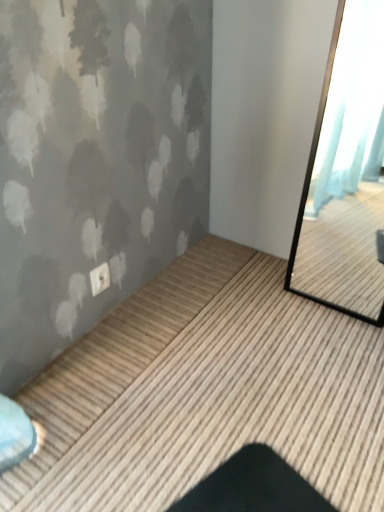
At what (x,y) coordinates should I click in order to perform the action: click on white plastic electric outlet at lower left. Please return your answer as a coordinate pair (x, y). The width and height of the screenshot is (384, 512). Looking at the image, I should click on (100, 278).

What do you see at coordinates (100, 278) in the screenshot? This screenshot has width=384, height=512. I see `white plastic electric outlet at lower left` at bounding box center [100, 278].

Locate an element on the screen. This screenshot has height=512, width=384. white plastic electric outlet at lower left is located at coordinates [100, 278].